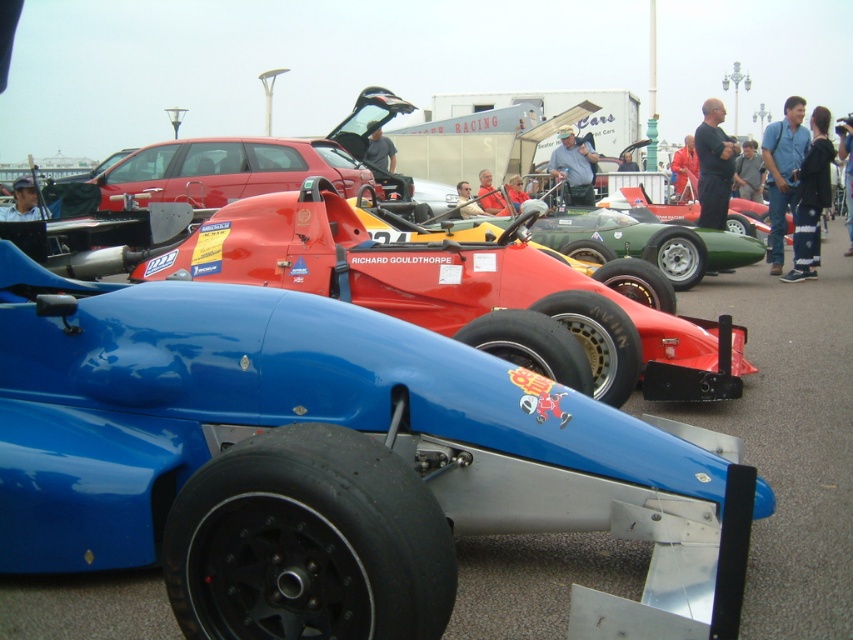
Question: Can you confirm if shiny red racing car at center is positioned below matte red car at center?

Choices:
 (A) no
 (B) yes

Answer: (B)

Question: Estimate the real-world distances between objects in this image. Which object is farther from the glossy blue race car at center?

Choices:
 (A) shiny red racing car at center
 (B) matte red car at center

Answer: (B)

Question: Which object appears closest to the camera in this image?

Choices:
 (A) shiny red racing car at center
 (B) matte red car at center
 (C) glossy blue race car at center

Answer: (C)

Question: Does glossy blue race car at center have a larger size compared to shiny red racing car at center?

Choices:
 (A) yes
 (B) no

Answer: (B)

Question: From the image, what is the correct spatial relationship of glossy blue race car at center in relation to matte red car at center?

Choices:
 (A) above
 (B) below

Answer: (B)

Question: Considering the real-world distances, which object is closest to the shiny red racing car at center?

Choices:
 (A) matte red car at center
 (B) glossy blue race car at center

Answer: (B)